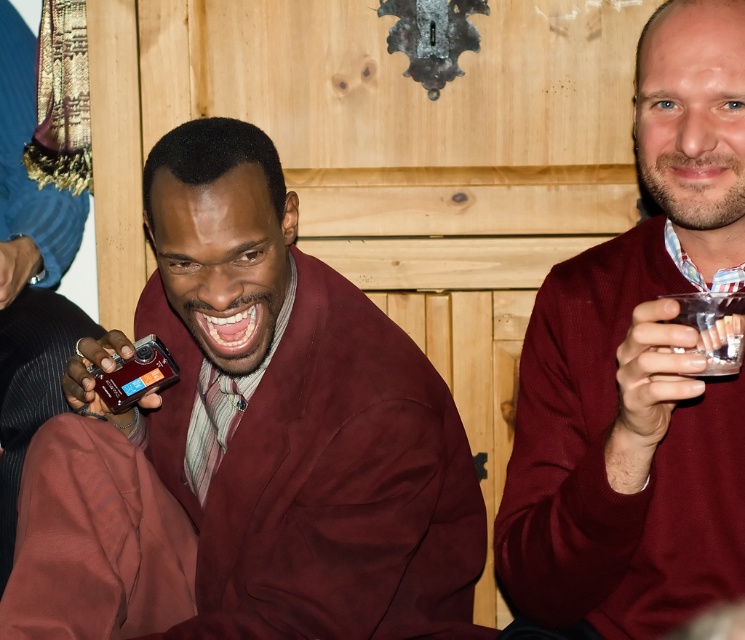
Question: Does matte burgundy sweater at left appear over maroon sweater at center?

Choices:
 (A) yes
 (B) no

Answer: (B)

Question: Among these points, which one is farthest from the camera?

Choices:
 (A) (422, 627)
 (B) (586, 486)

Answer: (A)

Question: Does matte burgundy sweater at left appear under maroon sweater at center?

Choices:
 (A) yes
 (B) no

Answer: (A)

Question: Which point is farther to the camera?

Choices:
 (A) maroon sweater at center
 (B) matte burgundy sweater at left

Answer: (B)

Question: Which object is farther from the camera taking this photo?

Choices:
 (A) maroon sweater at center
 (B) matte burgundy sweater at left

Answer: (B)

Question: Where is matte burgundy sweater at left located in relation to maroon sweater at center in the image?

Choices:
 (A) right
 (B) left

Answer: (B)